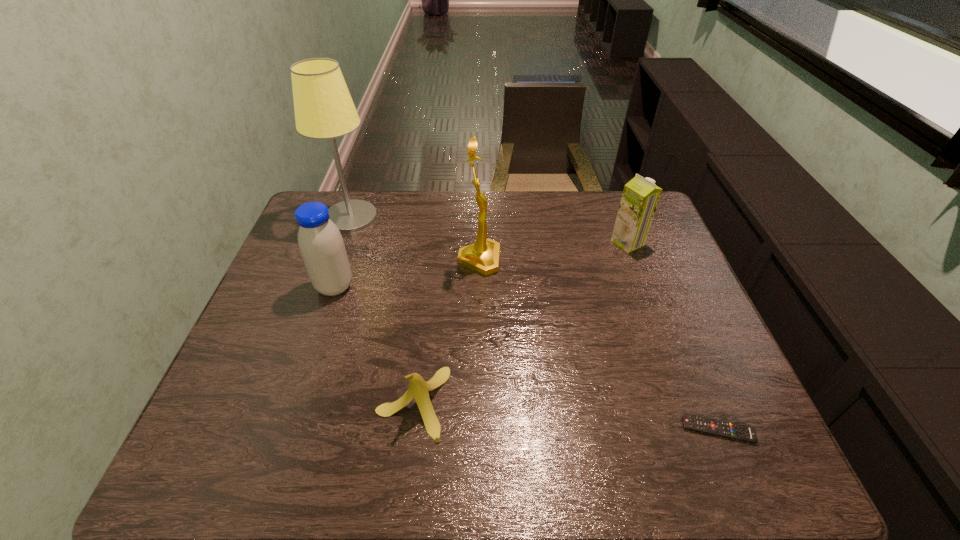
Locate an element on the screen. This screenshot has width=960, height=540. vacant space that's between the nearer soya milk and the third object from right to left is located at coordinates (407, 273).

Locate an element on the screen. Image resolution: width=960 pixels, height=540 pixels. vacant area that lies between the tallest object and the shortest object is located at coordinates 535,323.

Where is `vacant area that lies between the right soya milk and the table lamp`? vacant area that lies between the right soya milk and the table lamp is located at coordinates (490, 230).

Identify the location of free space between the fifth shortest object and the shortest object. The image size is (960, 540). (599, 345).

Image resolution: width=960 pixels, height=540 pixels. Identify the location of unoccupied area between the tallest object and the farther soya milk. (490, 230).

Locate an element on the screen. The width and height of the screenshot is (960, 540). vacant area that lies between the third object from left to right and the left soya milk is located at coordinates (373, 345).

Identify the location of vacant space in between the table lamp and the farther soya milk. Image resolution: width=960 pixels, height=540 pixels. (490, 230).

I want to click on free spot between the right soya milk and the fifth shortest object, so click(x=553, y=252).

Locate which object is the fifth closest to the nearer soya milk. Please provide its 2D coordinates. Your answer should be formatted as a tuple, i.e. [(x, y)], where the tuple contains the x and y coordinates of a point satisfying the conditions above.

[(726, 429)]

Identify which object is the fifth closest to the fourth object from left to right. Please provide its 2D coordinates. Your answer should be formatted as a tuple, i.e. [(x, y)], where the tuple contains the x and y coordinates of a point satisfying the conditions above.

[(726, 429)]